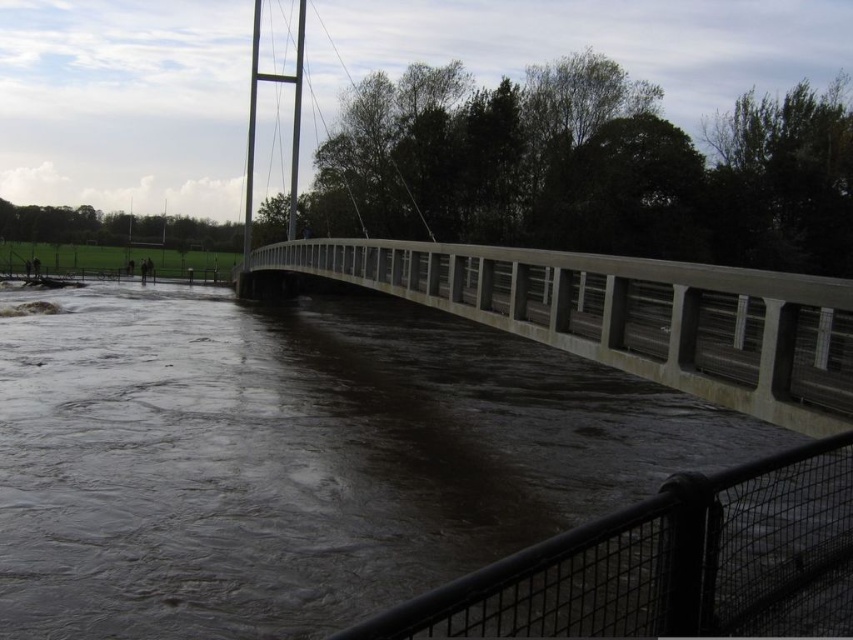
You are standing on the pedestrian bridge and want to reach the point marked at coordinates point (231, 509). Given that the bridge is 30 feet long, can you safely walk to that point without exceeding the bridge length?

The point (231, 509) is 29.57 feet away from the camera, which is within the 30 feet length of the bridge. Therefore, you can safely walk to that point without exceeding the bridge length.

You are a pedestrian standing on the concrete bridge at center. You notice the brown concrete river at center flowing below. Which one takes up more space in the image?

The concrete bridge at center takes up more space in the image than the brown concrete river at center, as the river is described as having a smaller size compared to the bridge.

Please provide the coordinates of the brown concrete river at center in the image. The coordinate system is based on the bottom left corner of the image as the origin point. The x and y values are normalized between 0 and 1. Please answer with two decimal places.

The coordinates of the brown concrete river at center are approximately at point [299,458].